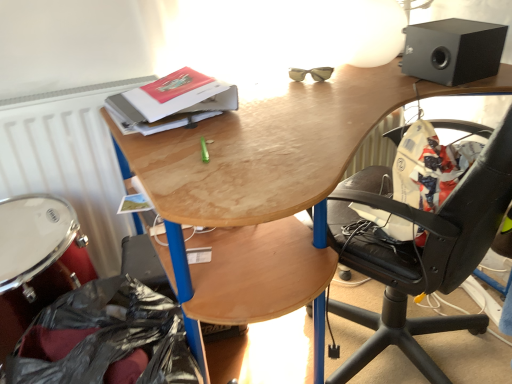
Identify the location of vacant area to the right of hardcover book at upper center. (283, 112).